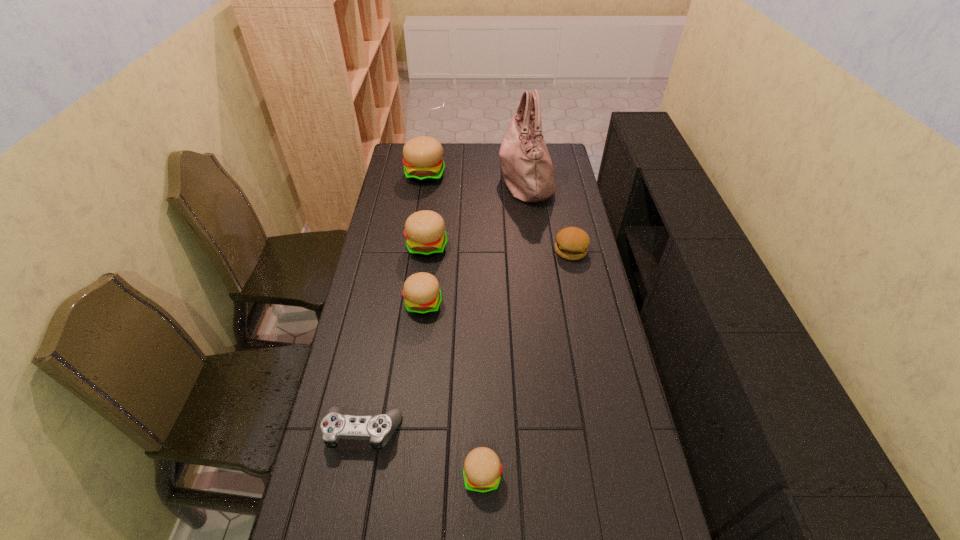
This screenshot has width=960, height=540. I want to click on vacant area at the right edge of the desktop, so click(561, 191).

Locate an element on the screen. free space at the far left corner of the desktop is located at coordinates (396, 146).

What are the coordinates of `empty space between the shortest object and the second biggest beige hamburger` in the screenshot? It's located at (395, 339).

I want to click on free space between the rightmost hamburger and the smallest beige hamburger, so click(527, 363).

Where is `vacant space in between the third smallest beige hamburger and the rightmost hamburger`? The image size is (960, 540). vacant space in between the third smallest beige hamburger and the rightmost hamburger is located at coordinates (499, 248).

You are a GUI agent. You are given a task and a screenshot of the screen. Output one action in this format:
    pyautogui.click(x=<x>, y=<y>)
    Task: Click on the free point between the third farthest beige hamburger and the tallest object
    
    Given the screenshot: What is the action you would take?
    (x=474, y=241)

Identify the location of free space between the rightmost hamburger and the tallest object. This screenshot has height=540, width=960. (548, 214).

The image size is (960, 540). What are the coordinates of `object that is the fifth closest to the smallest beige hamburger` in the screenshot? It's located at (527, 168).

Choose which object is the sixth nearest neighbor to the nearest hamburger. Please provide its 2D coordinates. Your answer should be formatted as a tuple, i.e. [(x, y)], where the tuple contains the x and y coordinates of a point satisfying the conditions above.

[(423, 163)]

Locate which hamburger ranks third in proximity to the control. Please provide its 2D coordinates. Your answer should be formatted as a tuple, i.e. [(x, y)], where the tuple contains the x and y coordinates of a point satisfying the conditions above.

[(424, 230)]